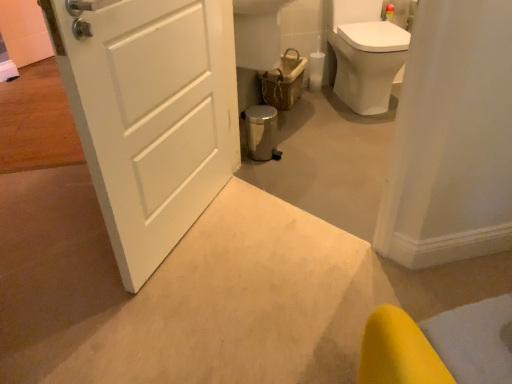
I want to click on free location in front of woven brown basket at center, so click(308, 116).